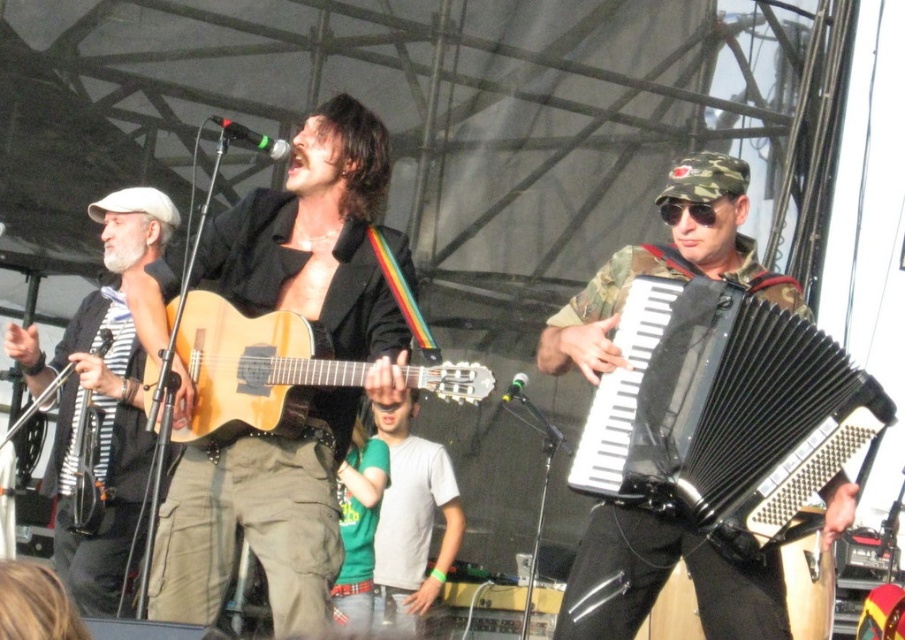
Question: Does white striped shirt at left have a larger size compared to natural wood acoustic guitar at center?

Choices:
 (A) no
 (B) yes

Answer: (B)

Question: Which is farther from the natural wood acoustic guitar at center?

Choices:
 (A) matte black guitar at center
 (B) black rubber accordion at right
 (C) white striped shirt at left

Answer: (B)

Question: Does matte black guitar at center appear on the right side of white striped shirt at left?

Choices:
 (A) yes
 (B) no

Answer: (A)

Question: Is white striped shirt at left further to the viewer compared to natural wood acoustic guitar at center?

Choices:
 (A) yes
 (B) no

Answer: (A)

Question: Which point is farther to the camera?

Choices:
 (A) (145, 378)
 (B) (793, 364)
 (C) (162, 516)

Answer: (C)

Question: Which object is positioned farthest from the white striped shirt at left?

Choices:
 (A) matte black guitar at center
 (B) natural wood acoustic guitar at center

Answer: (A)